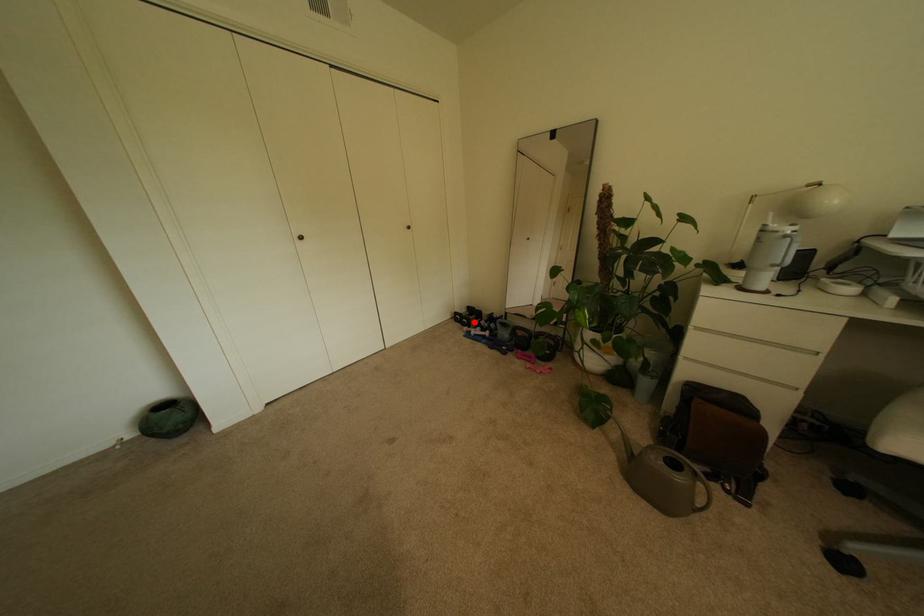
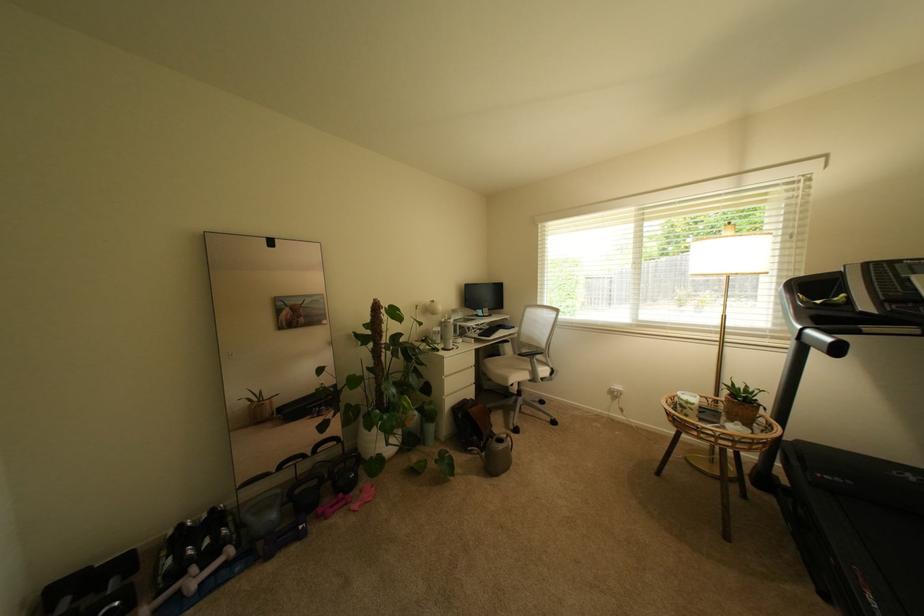
Question: A red point is marked in image1. In image2, is the corresponding 3D point closer to the camera or farther? Reply with the corresponding letter.

Choices:
 (A) The corresponding 3D point is closer.
 (B) The corresponding 3D point is farther.

Answer: (A)